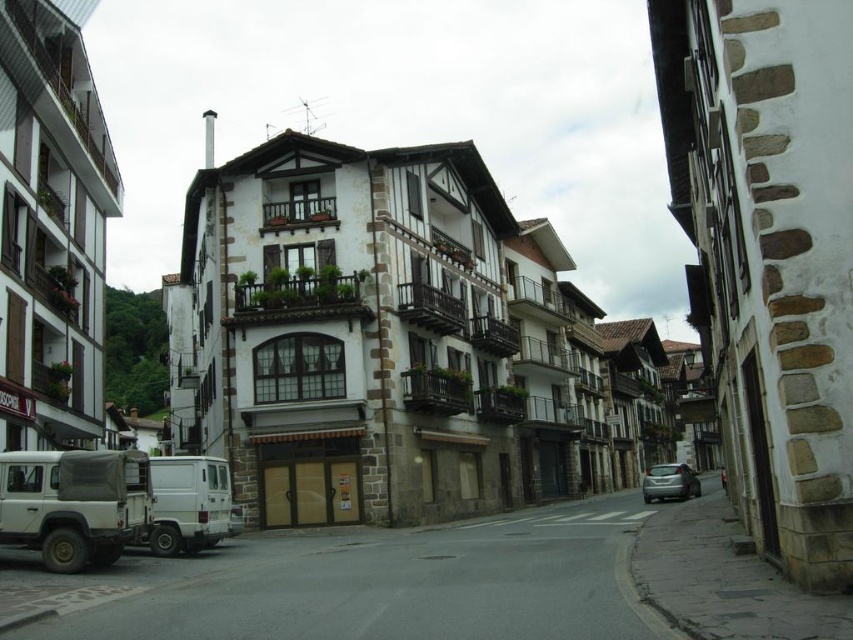
You are a delivery person who needs to park your vehicle between the white matte van at lower left and the satin silver car at lower right. Is there enough space between them for your vehicle which is 4 meters long?

The white matte van at lower left is to the left of satin silver car at lower right, but the distance between them is not specified. Without knowing the exact spacing, it is impossible to determine if there is sufficient room for a 4 meter vehicle.

You are standing at the point marked as point (86, 516) in this European town scene. A tour guide tells you that the distance between you and the viewer is 215.45 feet. If the tour guide asks you to estimate how far you are from the viewer in meters, what would you tell them?

The distance between point (86, 516) and the viewer is 215.45 feet. To convert feet to meters, multiply by 0.3048. 215.45 feet is approximately 65.67 meters. So, you are about 65.67 meters away from the viewer.

You are a tourist standing in the middle of the street looking towards the central building. You see two vehicles parked at the lower left corner of the image. Which one is positioned further to the left between the matte white van at lower left and the white matte van at lower left?

The matte white van at lower left is positioned further to the left compared to the white matte van at lower left as per the description.